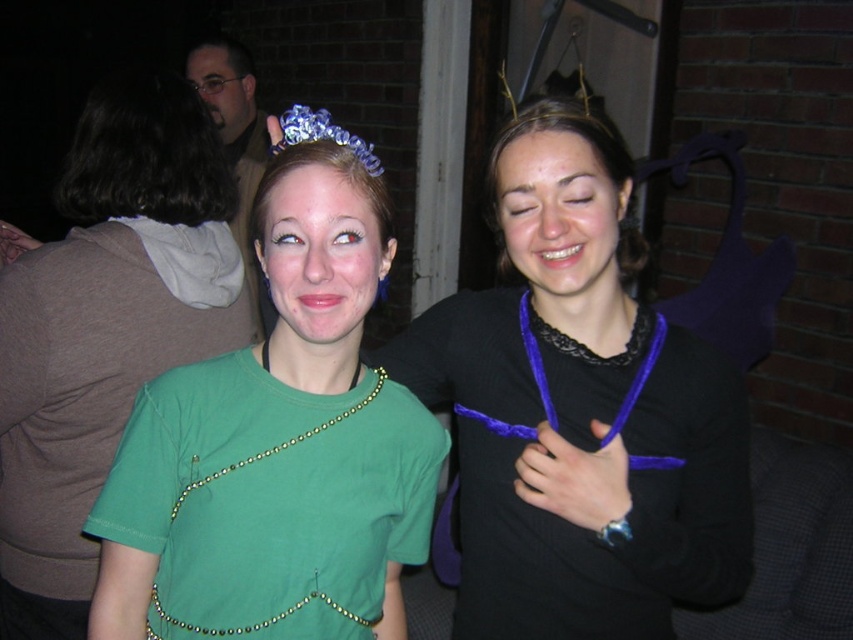
You are at the party and want to take a photo of both the person on the left and the person on the right. You notice two points marked in the image. The first point is at coordinate (604, 513) and the second is at (364, 572). If you want to ensure both people are in the frame, which point should you position the camera closer to?

You should position the camera closer to point (604, 513) because it is in front of point (364, 572), ensuring both individuals are within the frame.

You are a photographer at a costume party. You want to take a photo of the green beaded shirt at left and the green fabric face at center so that they are both in focus. The camera you are using has a depth of field that can cover 10 inches. Can you capture both subjects clearly in the same photo?

The distance between the green beaded shirt at left and the green fabric face at center is 12.79 inches, which exceeds the camera depth of field of 10 inches. Therefore, it is not possible to capture both subjects clearly in focus in the same photo.

You are a photographer at the party and want to take a photo of both the purple velvet necklace at center and the green fabric dress at center. Since you need to ensure both are fully visible in the frame, which object should you focus on first to avoid cropping?

The purple velvet necklace at center is taller than the green fabric dress at center, so you should focus on the purple velvet necklace at center first to ensure its full height is captured in the frame.